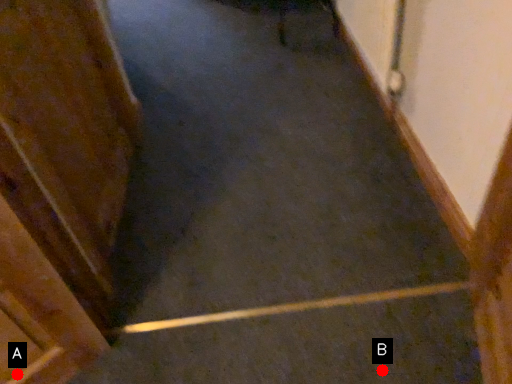
Question: Two points are circled on the image, labeled by A and B beside each circle. Which point appears closest to the camera in this image?

Choices:
 (A) A is closer
 (B) B is closer

Answer: (A)